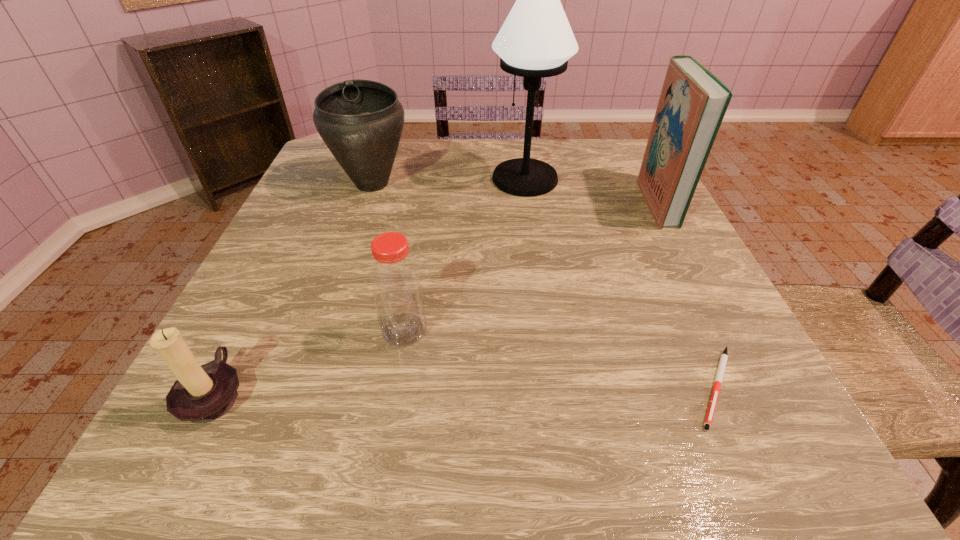
You are a GUI agent. You are given a task and a screenshot of the screen. Output one action in this format:
    pyautogui.click(x=<x>, y=<y>)
    Task: Click on the fifth closest object to the bottle
    
    Given the screenshot: What is the action you would take?
    pyautogui.click(x=693, y=102)

Identify the location of object that is the fifth closest to the fifth shortest object. (201, 394).

Find the location of a particular element. The height and width of the screenshot is (540, 960). free space that satisfies the following two spatial constraints: 1. on the clicker of the pen; 2. on the wick of the candle holder is located at coordinates (719, 393).

Where is `free space in the image that satisfies the following two spatial constraints: 1. on the cover of the hardback book; 2. on the clicker of the shortest object`? free space in the image that satisfies the following two spatial constraints: 1. on the cover of the hardback book; 2. on the clicker of the shortest object is located at coordinates (754, 386).

Where is `blank space that satisfies the following two spatial constraints: 1. on the front side of the urn; 2. on the wick of the fifth tallest object`? This screenshot has width=960, height=540. blank space that satisfies the following two spatial constraints: 1. on the front side of the urn; 2. on the wick of the fifth tallest object is located at coordinates (301, 393).

Where is `vacant space that satisfies the following two spatial constraints: 1. on the cover of the hardback book; 2. on the clicker of the shortest object`? The width and height of the screenshot is (960, 540). vacant space that satisfies the following two spatial constraints: 1. on the cover of the hardback book; 2. on the clicker of the shortest object is located at coordinates (754, 386).